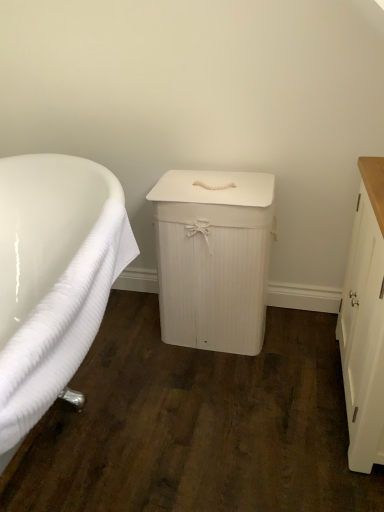
Question: In terms of height, does white ribbed towel at left look taller or shorter compared to white wood cabinet at right, which is the first cabinetry in right-to-left order?

Choices:
 (A) short
 (B) tall

Answer: (B)

Question: Is white ribbed towel at left to the left or to the right of white wood cabinet at right, marked as the 2th cabinetry in a left-to-right arrangement, in the image?

Choices:
 (A) left
 (B) right

Answer: (A)

Question: Based on their relative distances, which object is nearer to the white wood laundry bin at center, which ranks as the 1th cabinetry in left-to-right order?

Choices:
 (A) white ribbed towel at left
 (B) white wood cabinet at right, which is the first cabinetry in right-to-left order

Answer: (A)

Question: Considering the real-world distances, which object is farthest from the white ribbed towel at left?

Choices:
 (A) white wood laundry bin at center, which is the 2th cabinetry from right to left
 (B) white wood cabinet at right, marked as the 2th cabinetry in a left-to-right arrangement

Answer: (B)